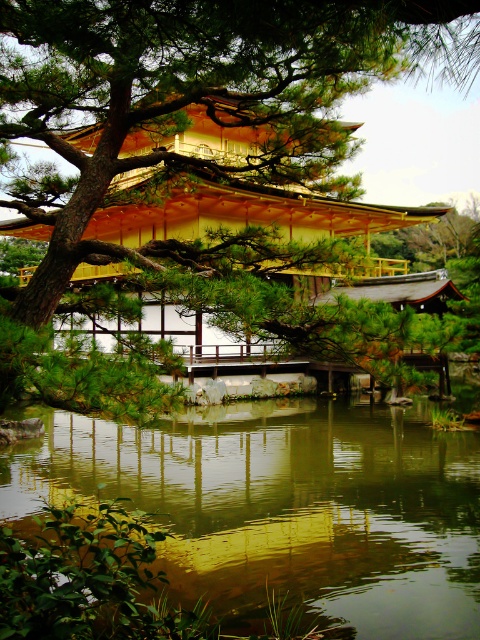
Question: Which point appears farthest from the camera in this image?

Choices:
 (A) (381, 618)
 (B) (347, 68)

Answer: (A)

Question: Does green textured pine tree at upper left have a greater width compared to green reflective water at center?

Choices:
 (A) yes
 (B) no

Answer: (B)

Question: Is green textured pine tree at upper left thinner than green reflective water at center?

Choices:
 (A) yes
 (B) no

Answer: (A)

Question: Which of the following is the farthest from the observer?

Choices:
 (A) green textured pine tree at upper left
 (B) green reflective water at center

Answer: (B)

Question: Which of the following is the closest to the observer?

Choices:
 (A) (194, 4)
 (B) (182, 413)

Answer: (A)

Question: Is green textured pine tree at upper left below green reflective water at center?

Choices:
 (A) no
 (B) yes

Answer: (A)